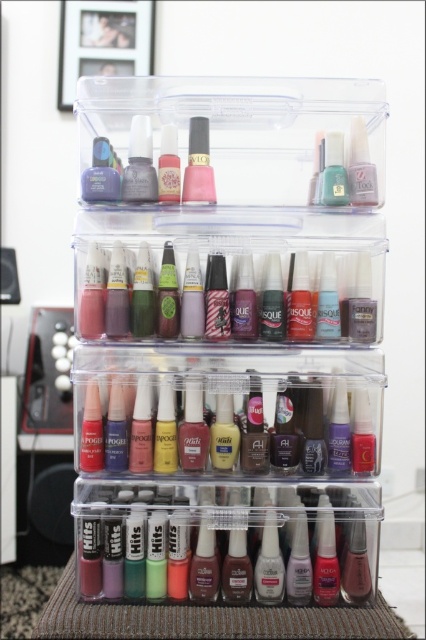
Question: Is matte plastic lipstick at center smaller than matte pink nail polish at center?

Choices:
 (A) yes
 (B) no

Answer: (B)

Question: Among these points, which one is farthest from the camera?

Choices:
 (A) (229, 308)
 (B) (101, 376)

Answer: (A)

Question: Among these points, which one is nearest to the camera?

Choices:
 (A) (178, 285)
 (B) (368, 198)
 (C) (350, 534)

Answer: (B)

Question: Can you confirm if matte plastic lipstick at center is smaller than matte pink lipstick at center?

Choices:
 (A) no
 (B) yes

Answer: (A)

Question: Which object is closer to the camera taking this photo?

Choices:
 (A) matte plastic lipstick at lower center
 (B) matte plastic lipstick at center
 (C) satin pink nail polish at center
 (D) matte pink lipstick at center

Answer: (C)

Question: Does matte plastic lipstick at lower center appear under satin pink nail polish at center?

Choices:
 (A) yes
 (B) no

Answer: (A)